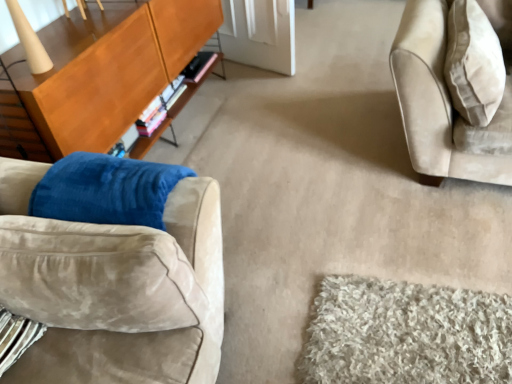
Question: Can you confirm if suede couch at left is shorter than wooden cabinet at left?

Choices:
 (A) yes
 (B) no

Answer: (A)

Question: Considering the relative sizes of suede couch at left and wooden cabinet at left in the image provided, is suede couch at left smaller than wooden cabinet at left?

Choices:
 (A) no
 (B) yes

Answer: (B)

Question: Does suede couch at left have a greater width compared to wooden cabinet at left?

Choices:
 (A) yes
 (B) no

Answer: (A)

Question: Can you confirm if suede couch at left is positioned to the left of wooden cabinet at left?

Choices:
 (A) yes
 (B) no

Answer: (B)

Question: From a real-world perspective, is suede couch at left over wooden cabinet at left?

Choices:
 (A) no
 (B) yes

Answer: (B)

Question: Does suede couch at left contain wooden cabinet at left?

Choices:
 (A) yes
 (B) no

Answer: (B)

Question: Is beige fabric pillow at upper right completely or partially inside wooden cabinet at left?

Choices:
 (A) yes
 (B) no

Answer: (B)

Question: Can you confirm if wooden cabinet at left is shorter than beige fabric pillow at upper right?

Choices:
 (A) no
 (B) yes

Answer: (A)

Question: Is the depth of wooden cabinet at left less than that of beige fabric pillow at upper right?

Choices:
 (A) no
 (B) yes

Answer: (B)

Question: Considering the relative sizes of wooden cabinet at left and beige fabric pillow at upper right in the image provided, is wooden cabinet at left wider than beige fabric pillow at upper right?

Choices:
 (A) yes
 (B) no

Answer: (B)

Question: Is wooden cabinet at left beside beige fabric pillow at upper right?

Choices:
 (A) yes
 (B) no

Answer: (B)

Question: Is wooden cabinet at left oriented towards beige fabric pillow at upper right?

Choices:
 (A) no
 (B) yes

Answer: (B)

Question: Can you confirm if wooden cabinet at left is positioned to the right of suede couch at left?

Choices:
 (A) yes
 (B) no

Answer: (B)